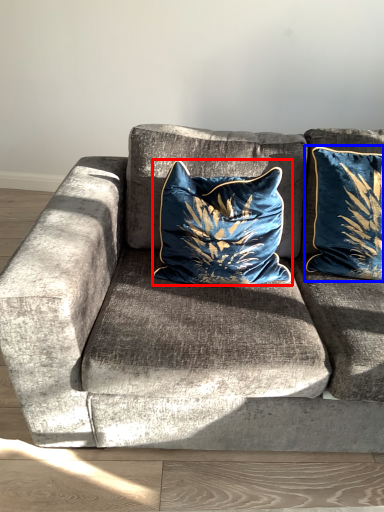
Question: Among these objects, which one is farthest to the camera, pillow (highlighted by a red box) or pillow (highlighted by a blue box)?

Choices:
 (A) pillow
 (B) pillow

Answer: (B)